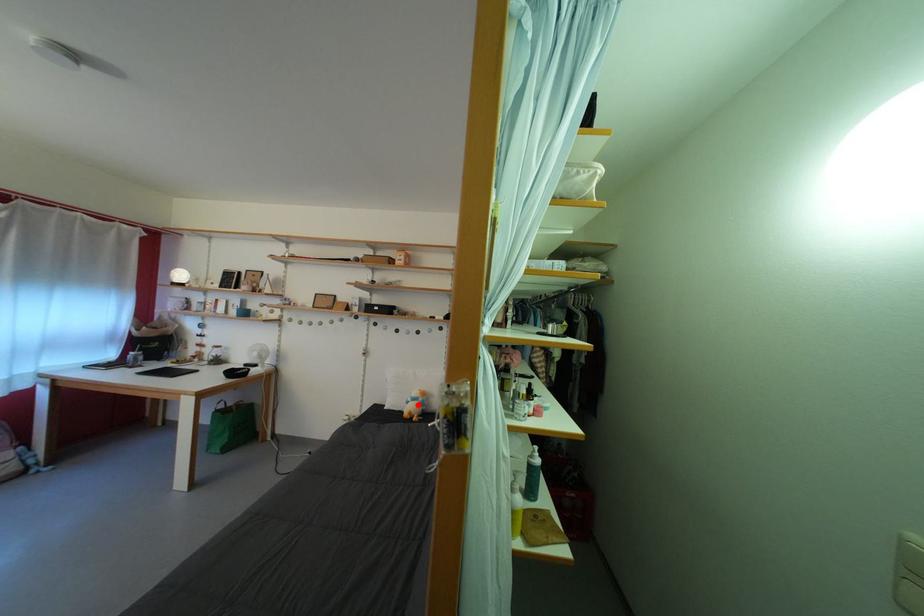
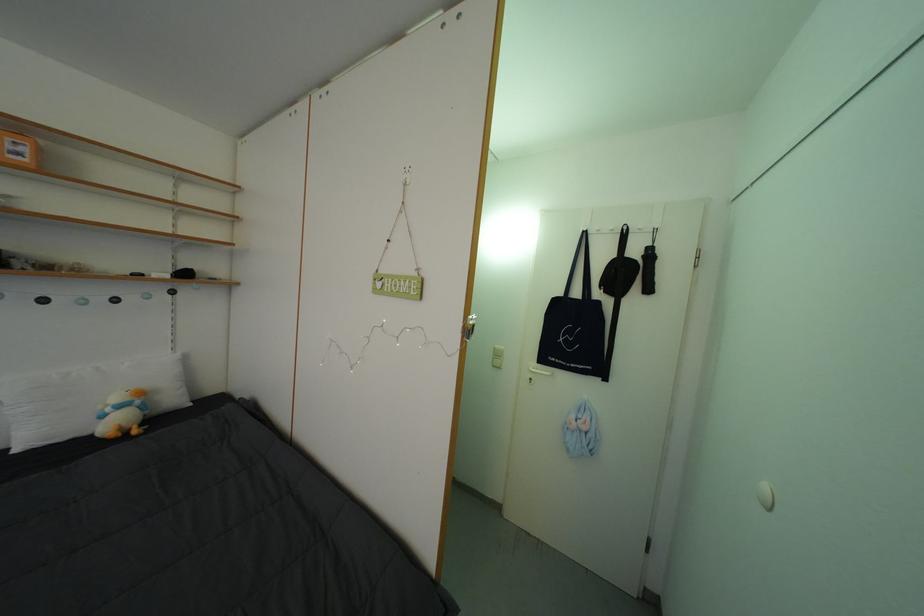
Question: I am providing you with two images of the same scene from different viewpoints. A red point is shown in image1. For the corresponding object point in image2, is it positioned nearer or farther from the camera?

Choices:
 (A) Nearer
 (B) Farther

Answer: (A)